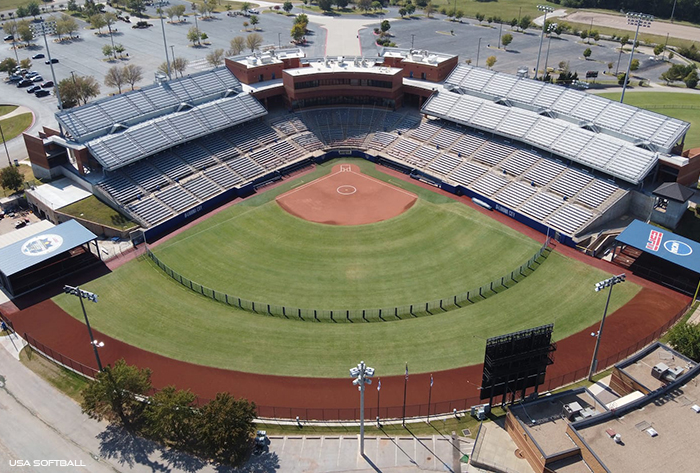
Identify the location of stands. (136, 136), (245, 120), (480, 102), (588, 150), (558, 189), (405, 148), (280, 154), (162, 205).